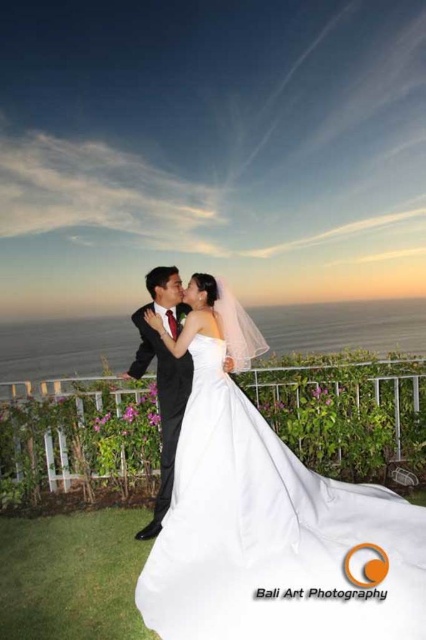
Who is lower down, white satin dress at center or black satin suit at center?

white satin dress at center is below.

Does white satin dress at center appear on the left side of black satin suit at center?

In fact, white satin dress at center is to the right of black satin suit at center.

Is point (201, 449) farther from viewer compared to point (138, 531)?

No, it is in front of (138, 531).

The height and width of the screenshot is (640, 426). Identify the location of white satin dress at center. (273, 536).